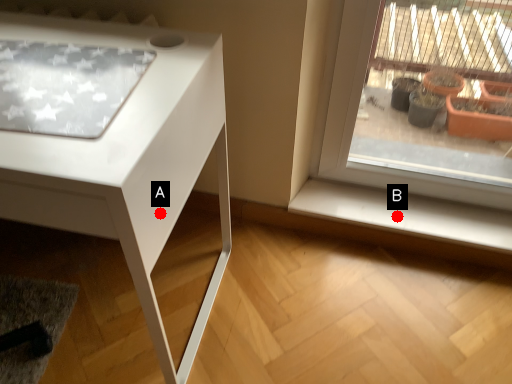
Question: Two points are circled on the image, labeled by A and B beside each circle. Which point is farther to the camera?

Choices:
 (A) A is further
 (B) B is further

Answer: (B)